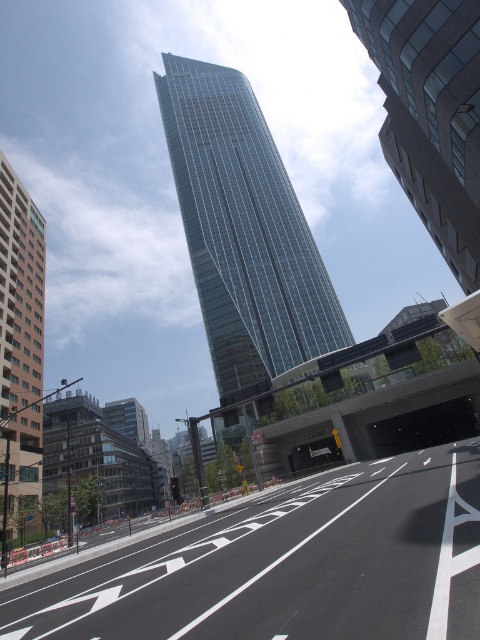
Is glassy metallic skyscraper at center below beige concrete building at left?

Actually, glassy metallic skyscraper at center is above beige concrete building at left.

Consider the image. Measure the distance between glassy metallic skyscraper at center and beige concrete building at left.

They are 83.23 meters apart.

Does point (317, 353) come closer to viewer compared to point (17, 204)?

No, (317, 353) is behind (17, 204).

Where is `glassy metallic skyscraper at center`? glassy metallic skyscraper at center is located at coordinates (243, 228).

Does glassy reflective skyscraper at center have a greater width compared to beige concrete building at left?

No, glassy reflective skyscraper at center is not wider than beige concrete building at left.

Looking at this image, is glassy reflective skyscraper at center to the right of beige concrete building at left from the viewer's perspective?

Yes, glassy reflective skyscraper at center is to the right of beige concrete building at left.

Which is in front, point (431, 54) or point (40, 304)?

Point (431, 54)

Locate an element on the screen. glassy reflective skyscraper at center is located at coordinates (431, 113).

Can you confirm if glassy metallic skyscraper at center is positioned to the left of glassy reflective skyscraper at center?

Indeed, glassy metallic skyscraper at center is positioned on the left side of glassy reflective skyscraper at center.

In the scene shown: Does glassy metallic skyscraper at center come behind glassy reflective skyscraper at center?

Yes, glassy metallic skyscraper at center is further from the viewer.

Where is `glassy metallic skyscraper at center`? glassy metallic skyscraper at center is located at coordinates [243, 228].